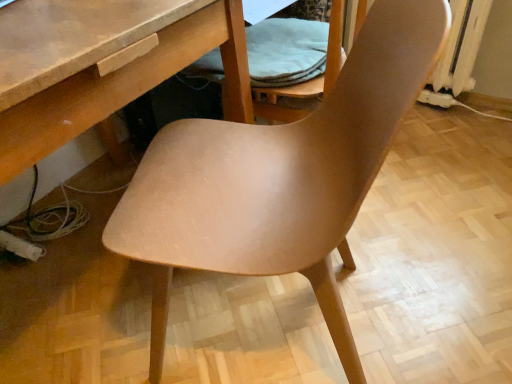
The width and height of the screenshot is (512, 384). What do you see at coordinates (308, 80) in the screenshot?
I see `light brown wood folding chair at center` at bounding box center [308, 80].

What is the approximate width of light brown wood folding chair at center?

The width of light brown wood folding chair at center is 13.87 inches.

The height and width of the screenshot is (384, 512). I want to click on light brown wood folding chair at center, so click(308, 80).

Locate an element on the screen. The image size is (512, 384). matte wood chair at center is located at coordinates (279, 178).

This screenshot has height=384, width=512. Describe the element at coordinates (279, 178) in the screenshot. I see `matte wood chair at center` at that location.

Locate an element on the screen. light brown wood folding chair at center is located at coordinates (308, 80).

Which is more to the left, matte wood chair at center or light brown wood folding chair at center?

matte wood chair at center is more to the left.

Which object is closer to the camera taking this photo, matte wood chair at center or light brown wood folding chair at center?

matte wood chair at center is in front.

Which is nearer, (x=351, y=154) or (x=325, y=94)?

Positioned in front is point (x=351, y=154).

From the image's perspective, does matte wood chair at center appear lower than light brown wood folding chair at center?

Yes, from the image's perspective, matte wood chair at center is below light brown wood folding chair at center.

From a real-world perspective, which is physically below, matte wood chair at center or light brown wood folding chair at center?

matte wood chair at center.

Which of these two, matte wood chair at center or light brown wood folding chair at center, is wider?

With larger width is matte wood chair at center.

Considering the relative sizes of matte wood chair at center and light brown wood folding chair at center in the image provided, is matte wood chair at center taller than light brown wood folding chair at center?

Yes, matte wood chair at center is taller than light brown wood folding chair at center.

Considering the sizes of objects matte wood chair at center and light brown wood folding chair at center in the image provided, who is smaller, matte wood chair at center or light brown wood folding chair at center?

light brown wood folding chair at center is smaller.

Which is correct: matte wood chair at center is inside light brown wood folding chair at center, or outside of it?

matte wood chair at center is located beyond the bounds of light brown wood folding chair at center.

Is matte wood chair at center placed right next to light brown wood folding chair at center?

matte wood chair at center and light brown wood folding chair at center are clearly separated.

Is light brown wood folding chair at center at the back of matte wood chair at center?

That's not correct — matte wood chair at center is not looking away from light brown wood folding chair at center.

Can you tell me how much matte wood chair at center and light brown wood folding chair at center differ in facing direction?

matte wood chair at center and light brown wood folding chair at center are facing 15.5 degrees away from each other.

Where is `folding chair behind the matte wood chair at center`? The image size is (512, 384). folding chair behind the matte wood chair at center is located at coordinates (308, 80).

Considering the relative positions of light brown wood folding chair at center and matte wood chair at center in the image provided, is light brown wood folding chair at center to the left or to the right of matte wood chair at center?

Based on their positions, light brown wood folding chair at center is located to the right of matte wood chair at center.

Which object is more forward, light brown wood folding chair at center or matte wood chair at center?

matte wood chair at center is in front.

Which is closer, (x=291, y=119) or (x=153, y=352)?

Point (x=291, y=119) is positioned farther from the camera compared to point (x=153, y=352).

From the image's perspective, is light brown wood folding chair at center above matte wood chair at center?

Yes, from the image's perspective, light brown wood folding chair at center is on top of matte wood chair at center.

From a real-world perspective, which is physically above, light brown wood folding chair at center or matte wood chair at center?

light brown wood folding chair at center is physically above.

Which object is wider, light brown wood folding chair at center or matte wood chair at center?

matte wood chair at center.

Is light brown wood folding chair at center taller or shorter than matte wood chair at center?

light brown wood folding chair at center is shorter than matte wood chair at center.

Does light brown wood folding chair at center have a smaller size compared to matte wood chair at center?

Yes, light brown wood folding chair at center is smaller than matte wood chair at center.

Is light brown wood folding chair at center spatially inside matte wood chair at center, or outside of it?

light brown wood folding chair at center cannot be found inside matte wood chair at center.

Are light brown wood folding chair at center and matte wood chair at center far apart?

No, light brown wood folding chair at center is not far away from matte wood chair at center.

Could you tell me if light brown wood folding chair at center is facing matte wood chair at center?

No, light brown wood folding chair at center is not aimed at matte wood chair at center.

Can you tell me how much light brown wood folding chair at center and matte wood chair at center differ in facing direction?

15.5 degrees.

Measure the distance between light brown wood folding chair at center and matte wood chair at center.

light brown wood folding chair at center and matte wood chair at center are 30.00 centimeters apart from each other.

Find the location of a particular element. This screenshot has width=512, height=384. folding chair that is above the matte wood chair at center (from a real-world perspective) is located at coordinates (308, 80).

You are a GUI agent. You are given a task and a screenshot of the screen. Output one action in this format:
    pyautogui.click(x=<x>, y=<y>)
    Task: Click on the folding chair located above the matte wood chair at center (from a real-world perspective)
    This screenshot has height=384, width=512.
    Given the screenshot: What is the action you would take?
    pyautogui.click(x=308, y=80)

This screenshot has width=512, height=384. Identify the location of chair that is under the light brown wood folding chair at center (from a real-world perspective). [x=279, y=178].